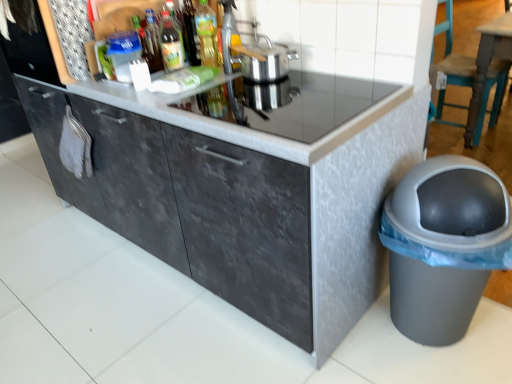
Question: From the image's perspective, is silver metallic pot at upper center positioned above or below teal wood chair at right?

Choices:
 (A) above
 (B) below

Answer: (B)

Question: In terms of width, does silver metallic pot at upper center look wider or thinner when compared to teal wood chair at right?

Choices:
 (A) thin
 (B) wide

Answer: (A)

Question: Estimate the real-world distances between objects in this image. Which object is closer to the translucent glass bottle at upper center, the first bottle in the right-to-left sequence?

Choices:
 (A) black glass countertop at center
 (B) dark gray textured cabinet at center
 (C) gray plastic trash can at lower right
 (D) green glass bottle at center, placed as the second bottle when sorted from right to left
 (E) metallic silver pot at upper center

Answer: (E)

Question: Which of these objects is positioned closest to the gray plastic trash can at lower right?

Choices:
 (A) metallic silver pot at upper center
 (B) translucent glass bottle at upper center, which appears as the second bottle when viewed from the left
 (C) silver metallic pot at upper center
 (D) dark gray textured cabinet at center
 (E) green glass bottle at center, which is counted as the 3th bottle, starting from the left

Answer: (D)